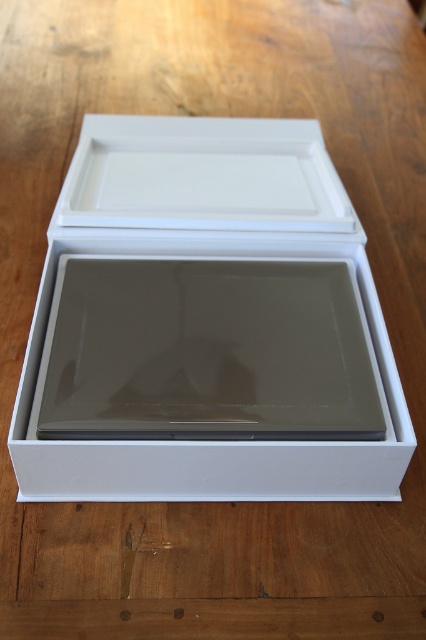
Between white matte box at center and white matte tray at upper center, which one appears on the right side from the viewer's perspective?

white matte tray at upper center is more to the right.

Who is higher up, white matte box at center or white matte tray at upper center?

white matte tray at upper center is above.

Is point (232, 486) closer to viewer compared to point (143, 188)?

Yes, point (232, 486) is closer to viewer.

In order to click on white matte box at center in this screenshot , I will do `click(207, 324)`.